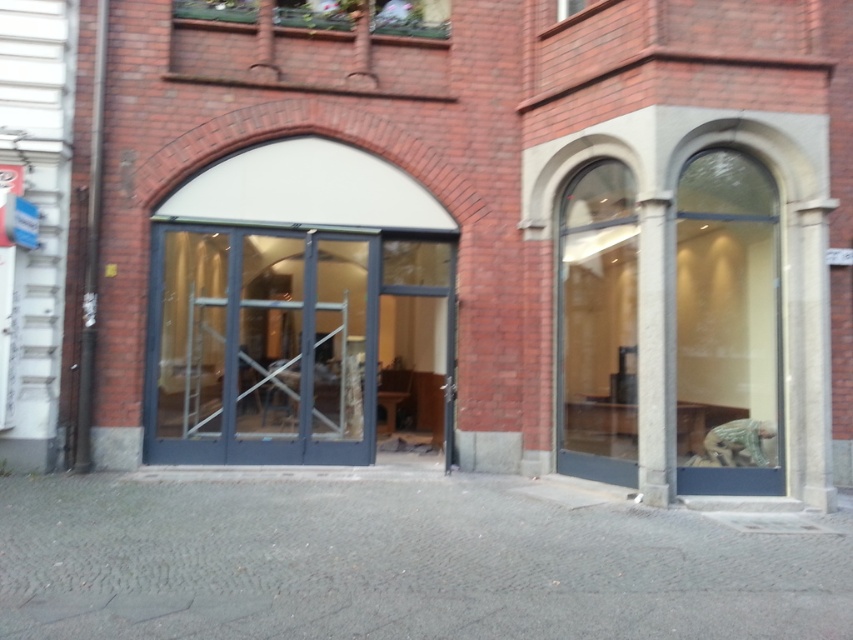
You are a delivery person approaching the building and need to access the entrance. The transparent glass door at center is the main entrance. Is the gray stone column at right blocking your path to the door?

The gray stone column at right is behind the transparent glass door at center, so it does not block your path to the door.

You are a delivery person approaching the building and need to find the entrance. The transparent glass door at center and the gray stone column at right are visible. Which object is closer to the left side from your perspective?

The transparent glass door at center is to the left of the gray stone column at right, so the transparent glass door at center is closer to the left side from your perspective.